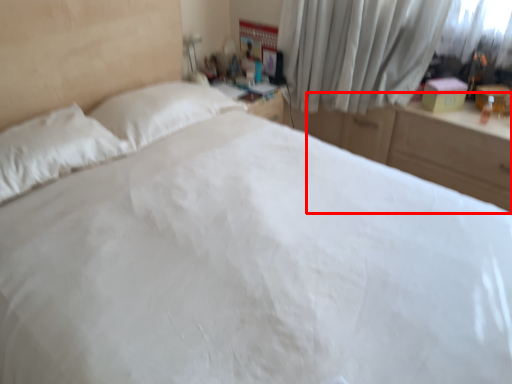
Question: In this image, where is dresser (annotated by the red box) located relative to curtain?

Choices:
 (A) left
 (B) right

Answer: (B)